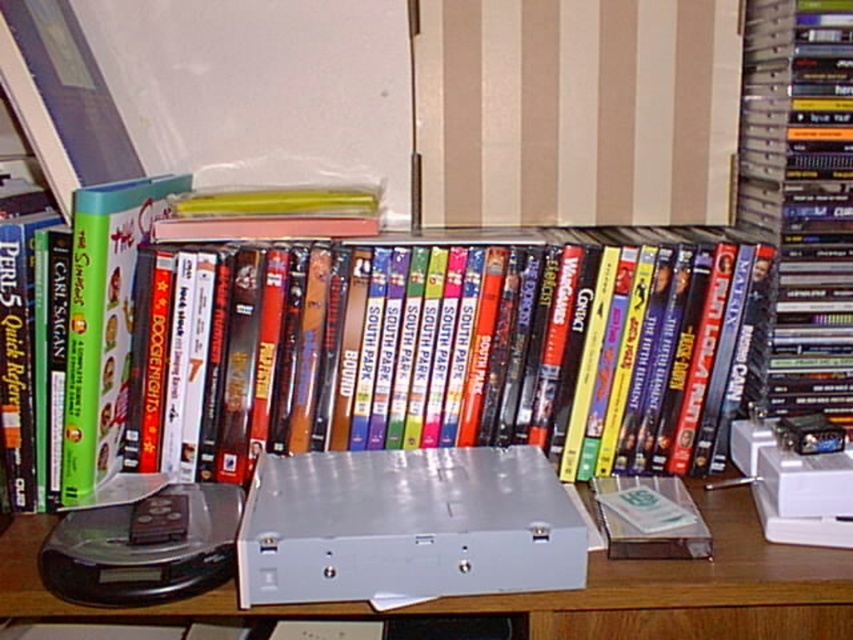
Question: Is hardcover book at center to the left of silver metallic computer desk at center from the viewer's perspective?

Choices:
 (A) yes
 (B) no

Answer: (A)

Question: Which point is closer to the camera taking this photo?

Choices:
 (A) (165, 454)
 (B) (44, 534)

Answer: (B)

Question: Is hardcover book at right in front of silver metallic computer desk at center?

Choices:
 (A) yes
 (B) no

Answer: (B)

Question: Which object is closer to the camera taking this photo?

Choices:
 (A) hardcover book at right
 (B) silver metallic computer desk at center
 (C) hardcover book at center

Answer: (B)

Question: Which point is closer to the camera?

Choices:
 (A) silver metallic computer desk at center
 (B) hardcover book at center
 (C) hardcover book at right

Answer: (A)

Question: Can you confirm if hardcover book at right is positioned to the left of silver metallic computer desk at center?

Choices:
 (A) no
 (B) yes

Answer: (A)